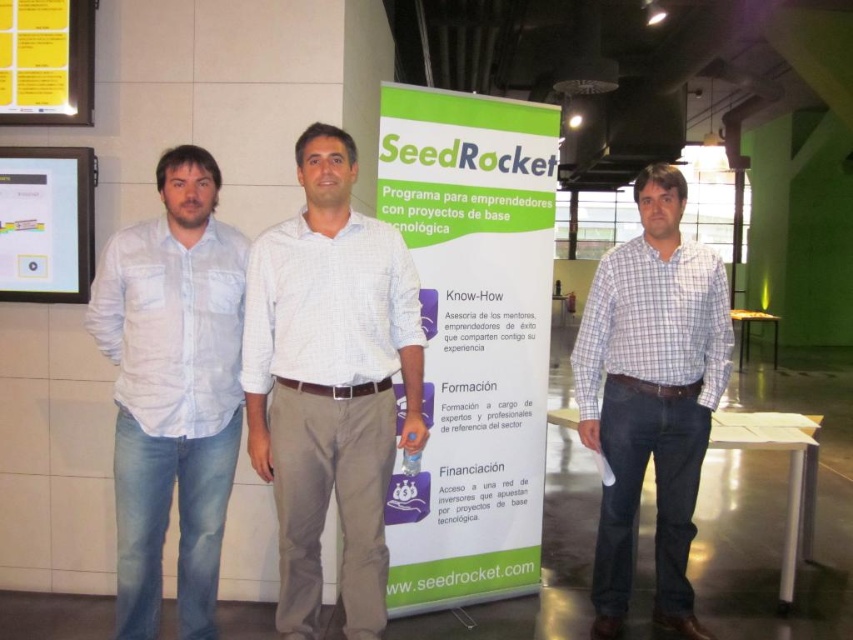
You are a photographer setting up a shot of the scene described. You need to ensure that the checkered fabric shirt at center and the matte plastic screen at left are both in frame. Given that your camera has a fixed focal length and you can only adjust your position, which direction should you move to include both objects without cropping either?

To include both the checkered fabric shirt at center and the matte plastic screen at left in frame without cropping, you should move backward since the checkered fabric shirt at center might be wider than the matte plastic screen at left, requiring a wider angle of view to capture both comfortably.

Based on the photo, you are a photographer trying to capture a group photo of the three men standing in front of the SeedRocket banner. You notice the light blue cotton shirt at left and the matte plastic screen at left. Which object should you adjust to ensure the entire group is visible in the photo?

The light blue cotton shirt at left is much taller than the matte plastic screen at left, so adjusting the light blue cotton shirt at left would help ensure the entire group is visible in the photo.